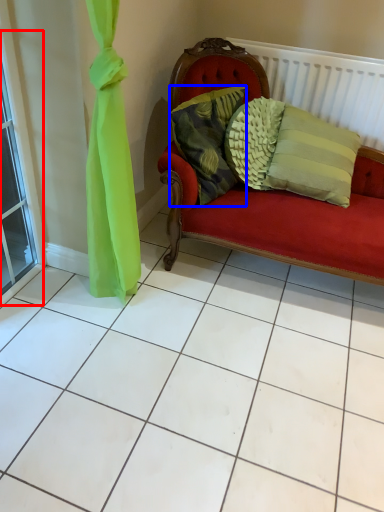
Question: Which point is further to the camera, window (highlighted by a red box) or pillow (highlighted by a blue box)?

Choices:
 (A) window
 (B) pillow

Answer: (B)